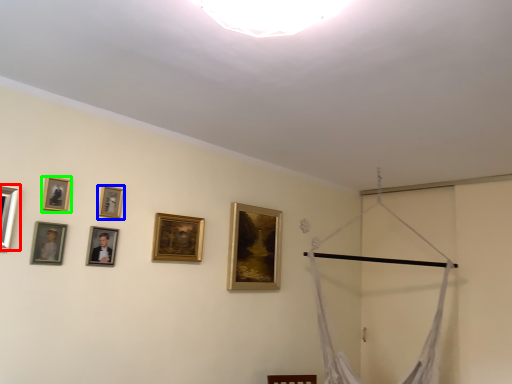
Question: Based on their relative distances, which object is nearer to picture frame (highlighted by a red box)? Choose from picture frame (highlighted by a blue box) and picture frame (highlighted by a green box).

Choices:
 (A) picture frame
 (B) picture frame

Answer: (B)